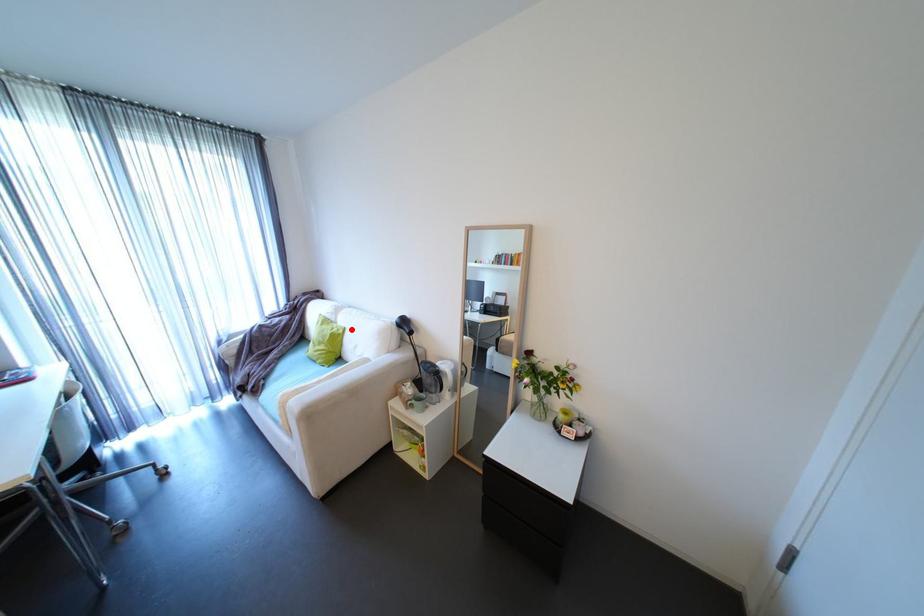
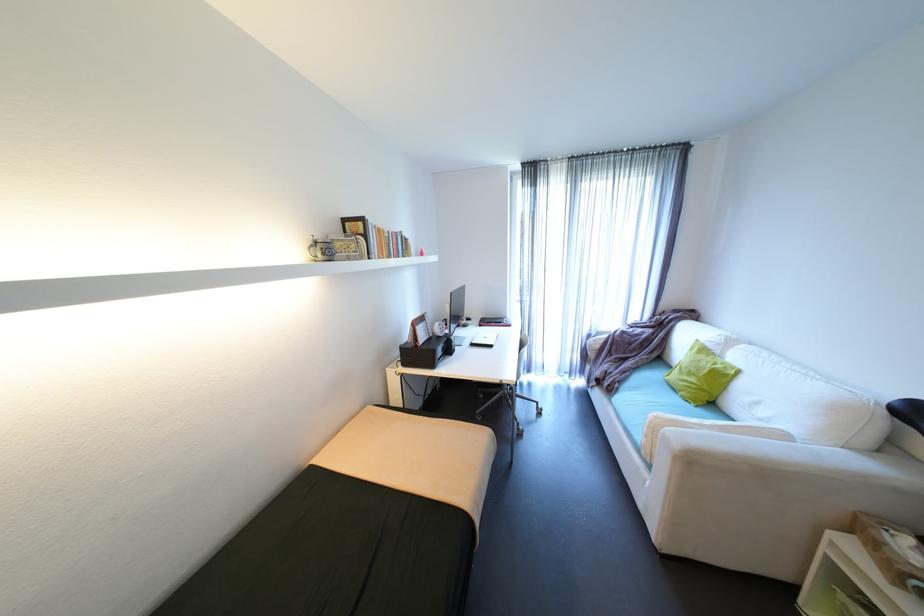
Question: I am providing you with two images of the same scene from different viewpoints. A red point is shown in image1. For the corresponding object point in image2, is it positioned nearer or farther from the camera?

Choices:
 (A) Nearer
 (B) Farther

Answer: (A)